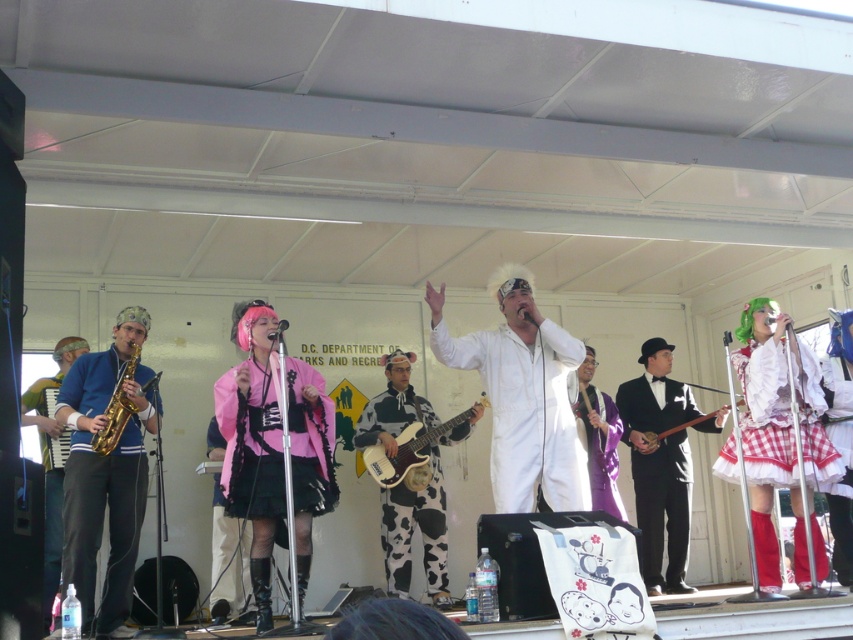
Question: Is white matte jumpsuit at center closer to the viewer compared to cow print fabric guitar at center?

Choices:
 (A) yes
 (B) no

Answer: (A)

Question: Based on their relative distances, which object is farther from the white gingham dress at right?

Choices:
 (A) cow print fabric guitar at center
 (B) gold shiny saxophone at left
 (C) wooden electric guitar at center

Answer: (B)

Question: Does black satin suit at center appear under cow print fabric guitar at center?

Choices:
 (A) no
 (B) yes

Answer: (A)

Question: Which point appears closest to the camera in this image?

Choices:
 (A) (107, 499)
 (B) (775, 451)
 (C) (224, 476)
 (D) (410, 426)

Answer: (C)

Question: Does white matte jumpsuit at center have a larger size compared to purple satin robe at center?

Choices:
 (A) yes
 (B) no

Answer: (A)

Question: Among these points, which one is nearest to the camera?

Choices:
 (A) (668, 435)
 (B) (328, 442)
 (C) (132, 352)
 (D) (415, 481)

Answer: (B)